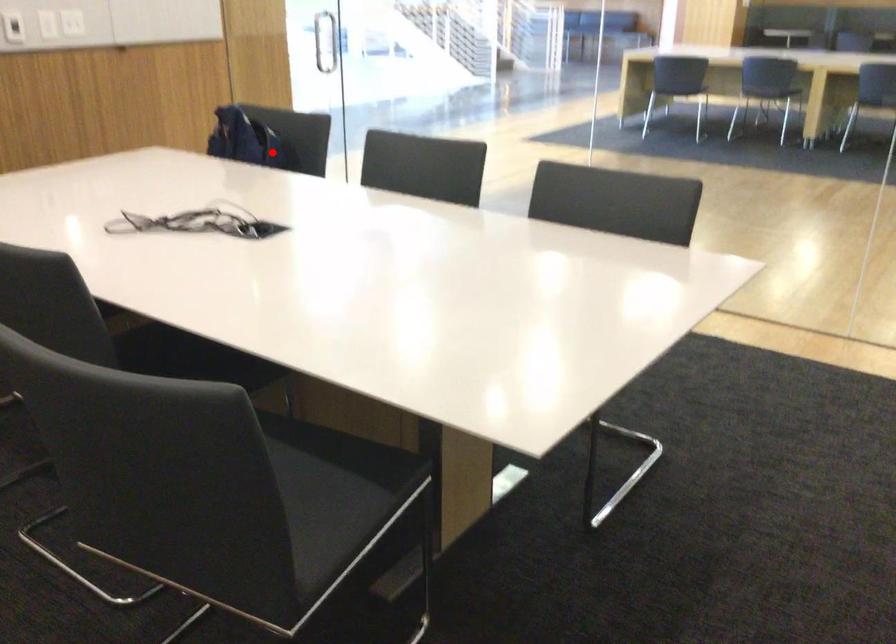
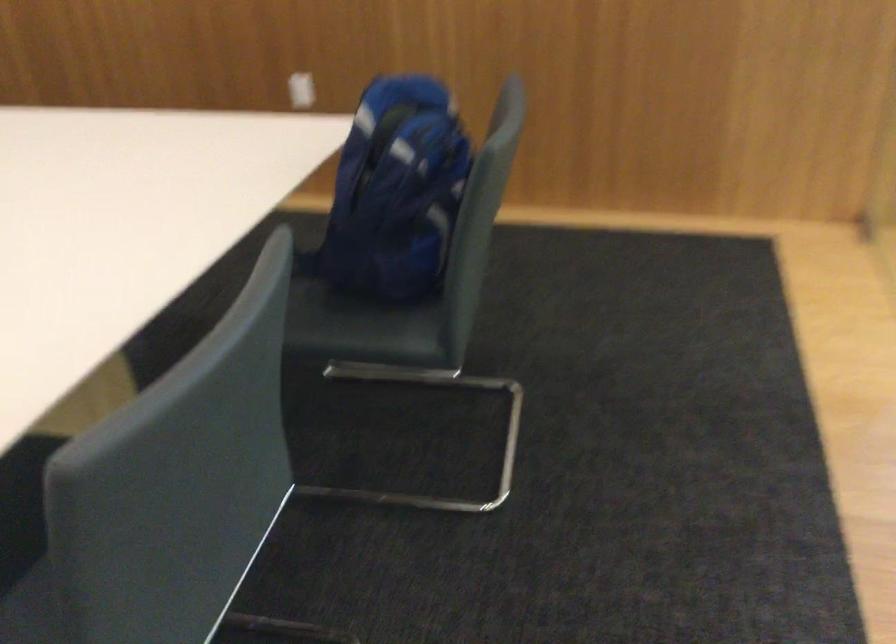
Find the pixel in the second image that matches the highlighted location in the first image.

(395, 192)